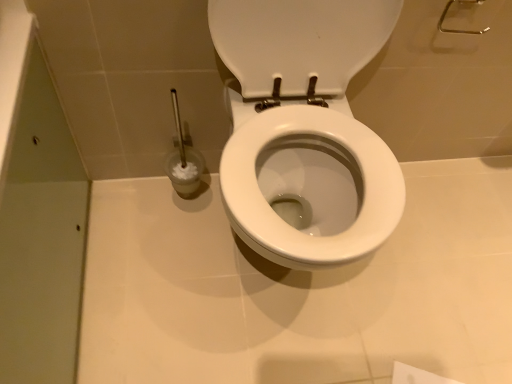
Where is `clear plastic brush at left`? Image resolution: width=512 pixels, height=384 pixels. clear plastic brush at left is located at coordinates (183, 159).

The width and height of the screenshot is (512, 384). What do you see at coordinates (183, 159) in the screenshot?
I see `clear plastic brush at left` at bounding box center [183, 159].

Where is `clear plastic brush at left`? This screenshot has height=384, width=512. clear plastic brush at left is located at coordinates (183, 159).